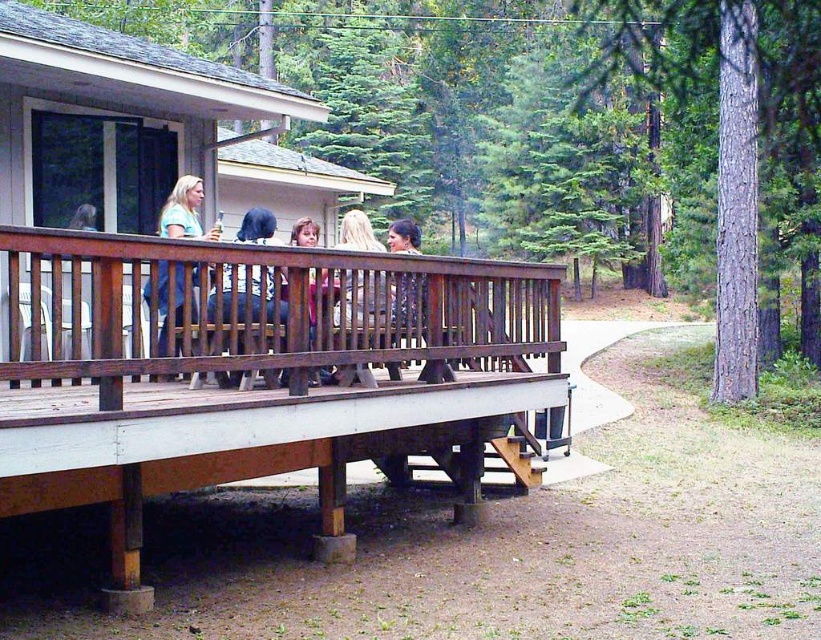
You are standing on the wooden deck and want to greet the person with blonde hair at center. The wooden bench at center is in your way. Which direction should you move to avoid the bench and reach the person?

Since the blonde hair at center is to the right of the wooden bench at center, you should move to the right side of the bench to reach the person without obstruction.

You are standing at the smooth brown shirt at center and want to reach the brown wooden cabin at center. The path is clear. Can you walk directly to the cabin without needing to take any steps?

The distance between the smooth brown shirt at center and the brown wooden cabin at center is 5.31 meters. Since the path is clear, you can walk directly to the cabin without needing to take any steps.